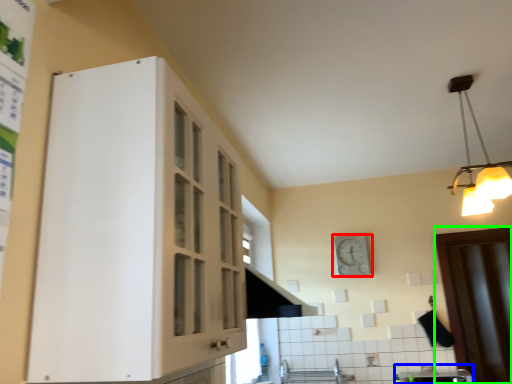
Question: Based on their relative distances, which object is farther from clock (highlighted by a red box)? Choose from sink (highlighted by a blue box) and door (highlighted by a green box).

Choices:
 (A) sink
 (B) door

Answer: (A)